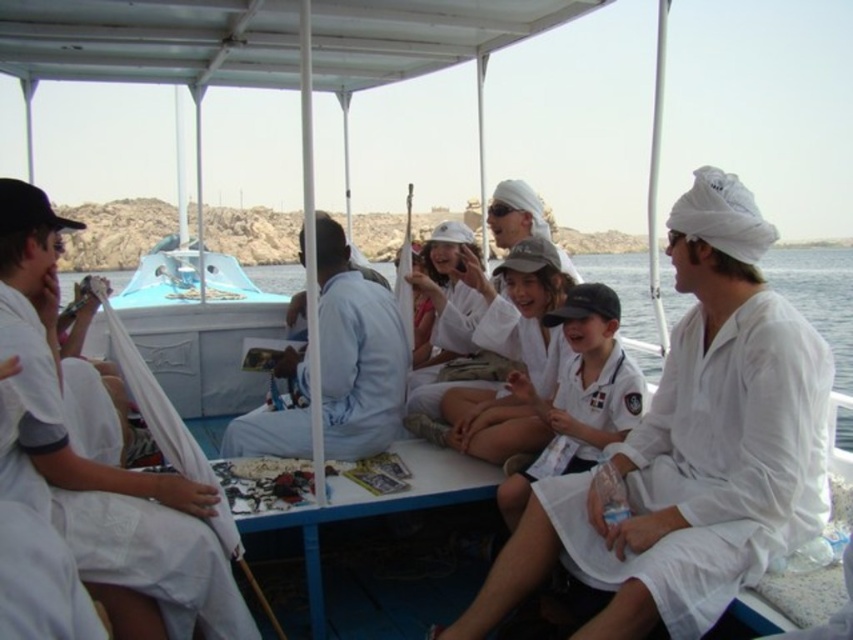
You are a photographer on the boat and need to capture a closeup of the white cotton robe at right. What are the coordinates to focus on?

The white cotton robe at right is located at coordinates point (717, 464), so focus there.

You are a photographer on the boat and need to capture a wide shot of the passengers. The white cotton robe at right and the light blue fabric at center are both in your frame. Which object should you focus on to ensure the wider subject is properly framed?

The light blue fabric at center has a greater width than the white cotton robe at right, so focusing on the light blue fabric at center will ensure the wider subject is properly framed.